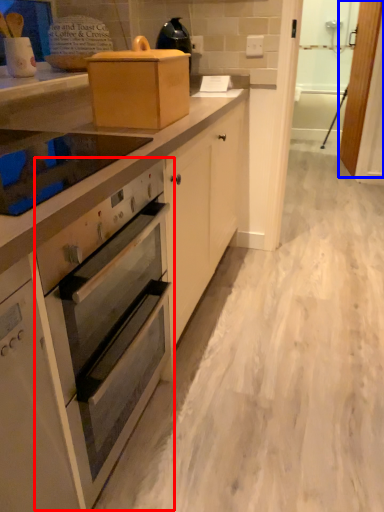
Question: Which of the following is the closest to the observer, oven (highlighted by a red box) or screen door (highlighted by a blue box)?

Choices:
 (A) oven
 (B) screen door

Answer: (A)